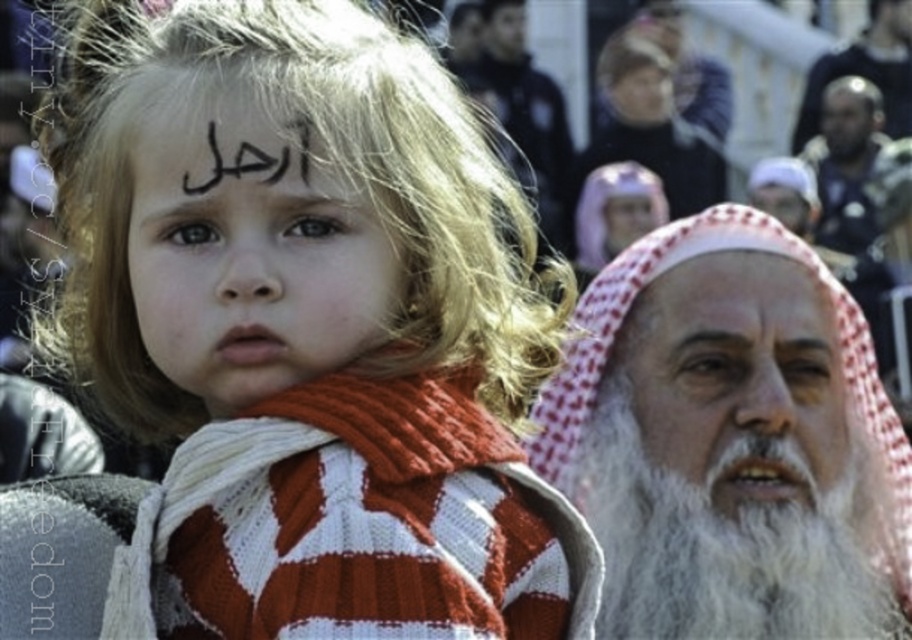
Who is taller, knitted wool scarf at center or white checkered headscarf at upper center?

Standing taller between the two is knitted wool scarf at center.

You are a GUI agent. You are given a task and a screenshot of the screen. Output one action in this format:
    pyautogui.click(x=<x>, y=<y>)
    Task: Click on the knitted wool scarf at center
    This screenshot has height=640, width=912.
    Given the screenshot: What is the action you would take?
    pyautogui.click(x=297, y=339)

Between white checkered cloth at center and gray hair at upper center, which one appears on the right side from the viewer's perspective?

From the viewer's perspective, white checkered cloth at center appears more on the right side.

Between point (696, 340) and point (708, 349), which one is positioned behind?

The point (696, 340) is more distant.

Where is `white checkered cloth at center`? This screenshot has height=640, width=912. white checkered cloth at center is located at coordinates 728,304.

Is point (213, 349) positioned before point (707, 280)?

Yes, it is.

Does matte black face at center appear under white checkered cloth at center?

Yes.

This screenshot has height=640, width=912. I want to click on matte black face at center, so click(249, 257).

You are a GUI agent. You are given a task and a screenshot of the screen. Output one action in this format:
    pyautogui.click(x=<x>, y=<y>)
    Task: Click on the matte black face at center
    Image resolution: width=912 pixels, height=640 pixels.
    Given the screenshot: What is the action you would take?
    pyautogui.click(x=249, y=257)